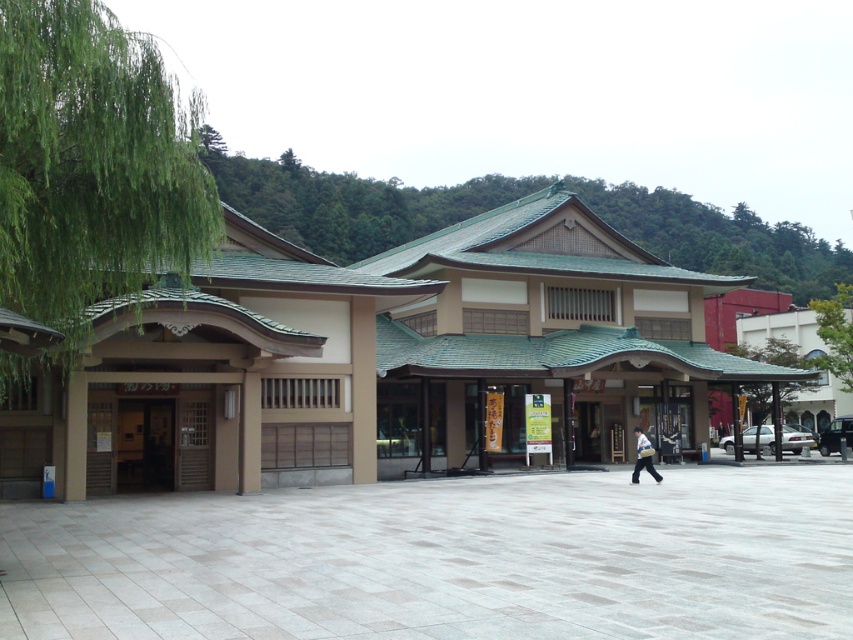
Question: Observing the image, what is the correct spatial positioning of green leafy tree at left in reference to green leafy tree at upper left?

Choices:
 (A) right
 (B) left

Answer: (B)

Question: Can you confirm if green leafy tree at upper left is positioned to the right of light blue fabric bag at center?

Choices:
 (A) yes
 (B) no

Answer: (A)

Question: Which object appears closest to the camera in this image?

Choices:
 (A) green leafy tree at upper left
 (B) green leafy tree at right
 (C) light blue fabric bag at center
 (D) green leafy tree at left

Answer: (D)

Question: Which point is farther to the camera?

Choices:
 (A) green leafy tree at right
 (B) green leafy tree at upper left

Answer: (B)

Question: Which point appears farthest from the camera in this image?

Choices:
 (A) (642, 435)
 (B) (537, 456)

Answer: (B)

Question: Is green leafy tree at left wider than light blue fabric bag at center?

Choices:
 (A) no
 (B) yes

Answer: (B)